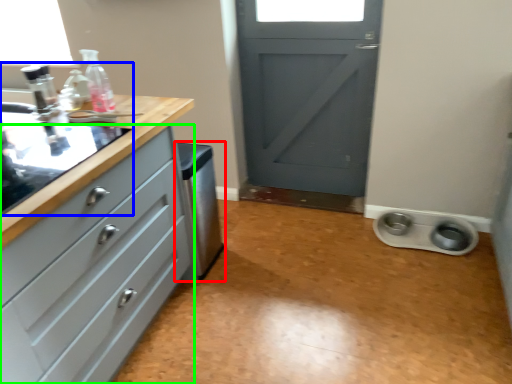
Question: Which object is the farthest from dish washer (highlighted by a red box)? Choose among these: sink (highlighted by a blue box) or chest of drawers (highlighted by a green box).

Choices:
 (A) sink
 (B) chest of drawers

Answer: (A)